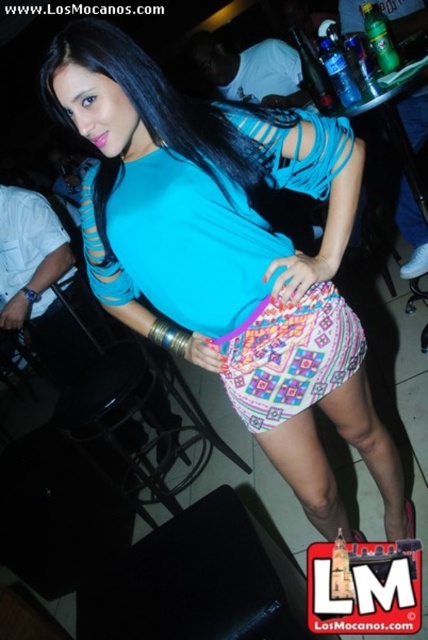
Question: Is the position of matte blue top at center less distant than that of turquoise fabric dress at center?

Choices:
 (A) no
 (B) yes

Answer: (B)

Question: Can you confirm if matte blue top at center is wider than turquoise fabric dress at center?

Choices:
 (A) no
 (B) yes

Answer: (B)

Question: Is matte blue top at center above turquoise fabric dress at center?

Choices:
 (A) no
 (B) yes

Answer: (A)

Question: Which object is closer to the camera taking this photo?

Choices:
 (A) turquoise fabric dress at center
 (B) matte blue top at center

Answer: (B)